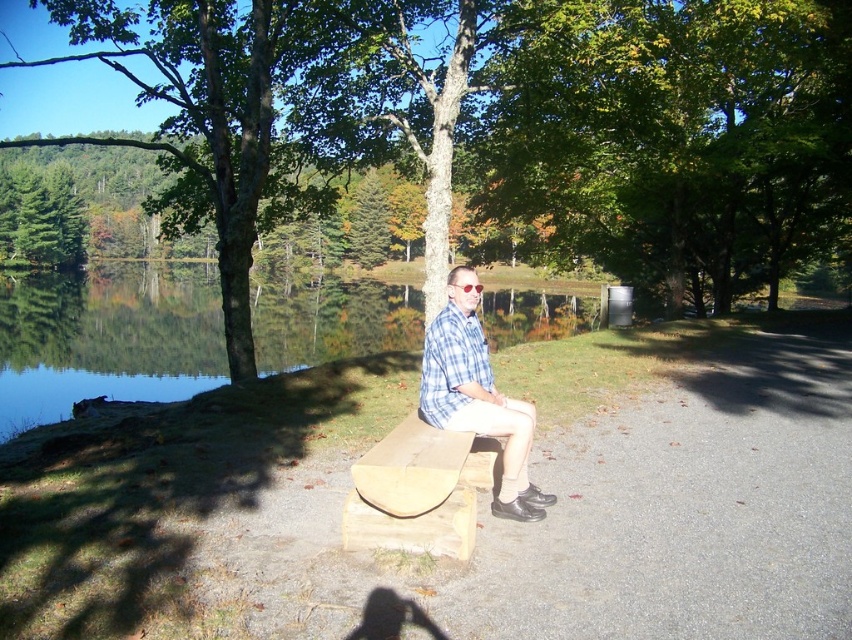
You are a photographer trying to capture a photo of the blue plaid shirt at center without the green textured tree at center blocking the view. Based on the scene, is the tree likely to block the shirt in the photo?

The green textured tree at center is larger in size than the blue plaid shirt at center, so it might block the view depending on their positions. However, since both are at the center, the tree could overshadow the shirt in the photo.